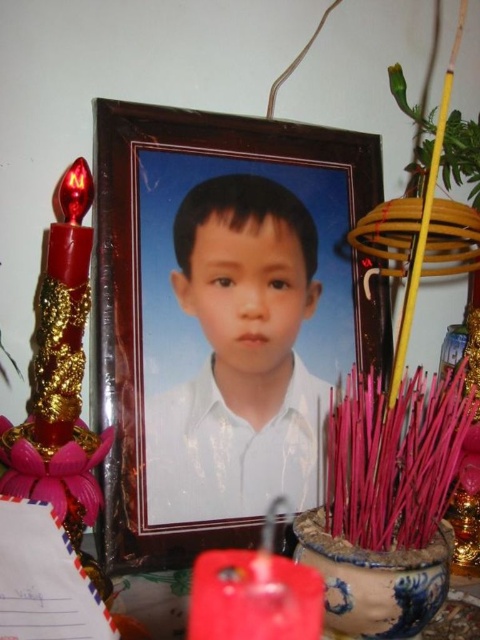
You are arranging a small table for a ceremony. The table currently has a shiny gold candle at left and a blue ceramic pot at center. According to the image, which object is positioned to the right of the other?

The blue ceramic pot at center is positioned to the right of the shiny gold candle at left.

You are an interior designer arranging items on a shelf. You have a white glossy shirt at center and a matte red candle at lower center. According to the scene, which item is placed higher?

The white glossy shirt at center is positioned over the matte red candle at lower center, so it is placed higher.

You are an interior designer arranging items on a shelf. You have a wooden frame at center and a blue ceramic pot at center. Which object should you place on the left side of the shelf if you want the wider item to be on the right side?

The wooden frame at center is wider than the blue ceramic pot at center. Therefore, to have the wider item on the right, place the blue ceramic pot at center on the left side of the shelf and the wooden frame at center on the right side.